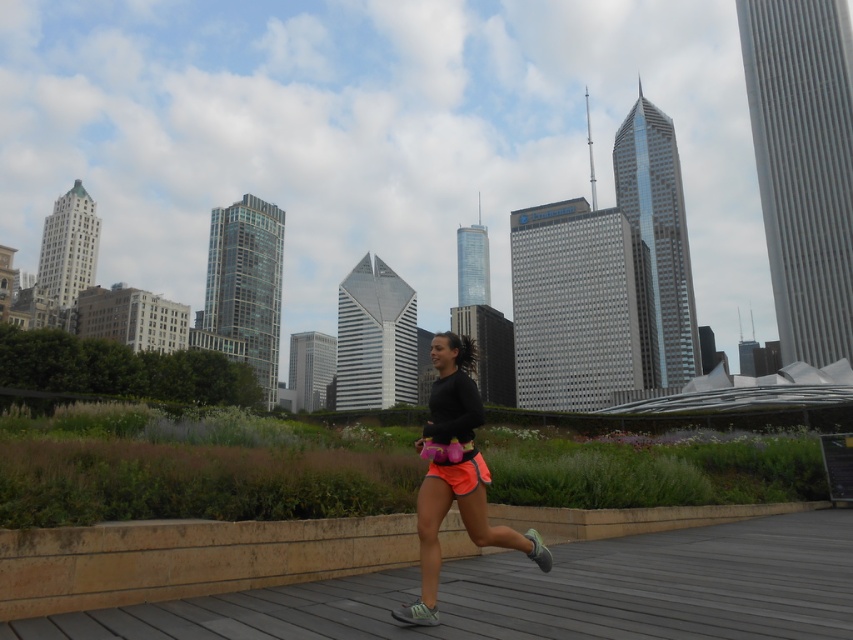
Which of these two, wooden deck at center or neon orange shorts at center, stands taller?

Standing taller between the two is neon orange shorts at center.

Does point (291, 589) lie in front of point (416, 611)?

No, it is not.

Is point (840, 547) farther from camera compared to point (432, 422)?

Yes, it is behind point (432, 422).

At what (x,y) coordinates should I click in order to perform the action: click on wooden deck at center. Please return your answer as a coordinate pair (x, y). This screenshot has height=640, width=853. Looking at the image, I should click on (541, 593).